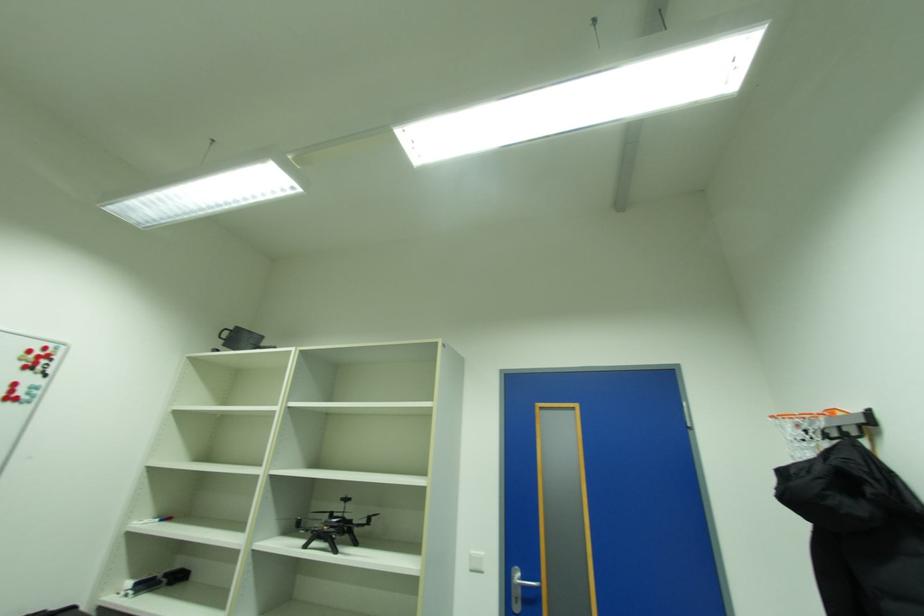
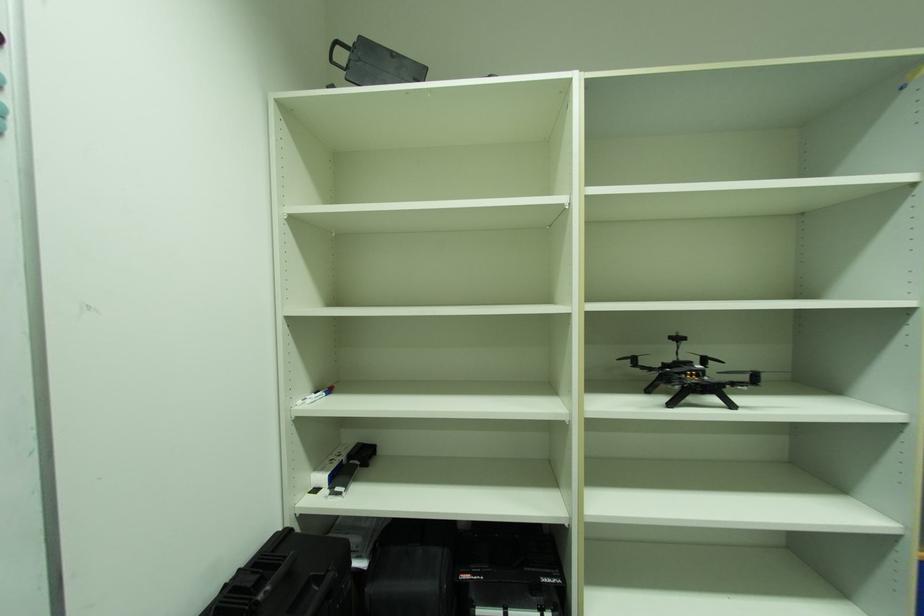
The images are taken continuously from a first-person perspective. In which direction are you moving?

The cameraman moved toward left, forward.